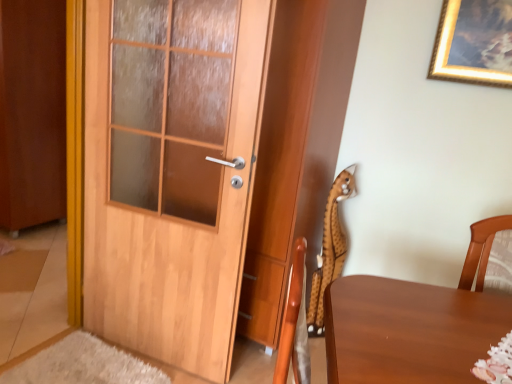
Question: From a real-world perspective, is spotted plush toy at right over brown wooden door at left?

Choices:
 (A) no
 (B) yes

Answer: (A)

Question: Considering the relative sizes of spotted plush toy at right and brown wooden door at left in the image provided, is spotted plush toy at right shorter than brown wooden door at left?

Choices:
 (A) no
 (B) yes

Answer: (B)

Question: Is spotted plush toy at right closer to the viewer compared to brown wooden door at left?

Choices:
 (A) no
 (B) yes

Answer: (B)

Question: From the image's perspective, is spotted plush toy at right above brown wooden door at left?

Choices:
 (A) yes
 (B) no

Answer: (B)

Question: Can you confirm if spotted plush toy at right is positioned to the left of brown wooden door at left?

Choices:
 (A) yes
 (B) no

Answer: (B)

Question: Is spotted plush toy at right positioned with its back to brown wooden door at left?

Choices:
 (A) no
 (B) yes

Answer: (A)

Question: Considering the relative sizes of wooden door at left and spotted plush toy at right in the image provided, is wooden door at left bigger than spotted plush toy at right?

Choices:
 (A) yes
 (B) no

Answer: (A)

Question: Is wooden door at left at the right side of spotted plush toy at right?

Choices:
 (A) no
 (B) yes

Answer: (A)

Question: Could spotted plush toy at right be considered to be inside wooden door at left?

Choices:
 (A) no
 (B) yes

Answer: (A)

Question: Can you confirm if wooden door at left is smaller than spotted plush toy at right?

Choices:
 (A) yes
 (B) no

Answer: (B)

Question: Considering the relative sizes of wooden door at left and spotted plush toy at right in the image provided, is wooden door at left taller than spotted plush toy at right?

Choices:
 (A) no
 (B) yes

Answer: (B)

Question: Is the position of wooden door at left less distant than that of spotted plush toy at right?

Choices:
 (A) yes
 (B) no

Answer: (A)

Question: Considering the relative sizes of brown wooden door at left and spotted plush toy at right in the image provided, is brown wooden door at left bigger than spotted plush toy at right?

Choices:
 (A) yes
 (B) no

Answer: (A)